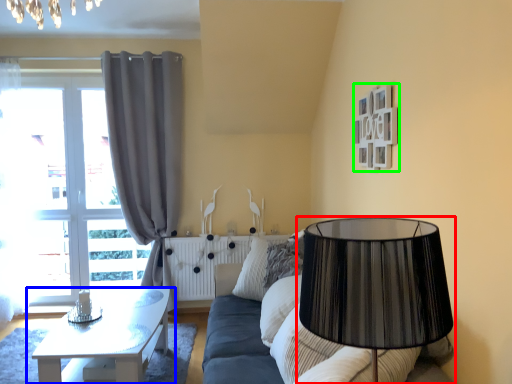
Question: Considering the real-world distances, which object is closest to lamp (highlighted by a red box)? table (highlighted by a blue box) or picture frame (highlighted by a green box).

Choices:
 (A) table
 (B) picture frame

Answer: (B)